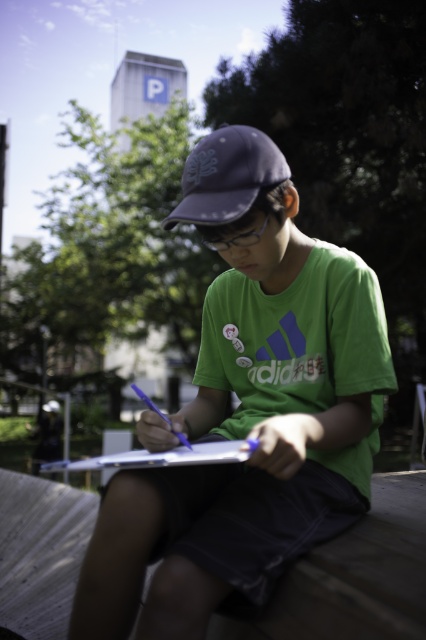
You are a fashion designer observing the image and want to note the position of the green matte shirt at center. What are its coordinates?

The green matte shirt at center is located at coordinates point (247, 410).

You are an observer looking at the scene. You see a green matte shirt at center and a white paper at center. Which object is shorter in height?

The green matte shirt at center is shorter in height compared to the white paper at center.

You are trying to determine the position of the matte blue baseball cap at center relative to the white paper at center. Based on the scene, which object is located to the right?

The matte blue baseball cap at center is to the right of the white paper at center.